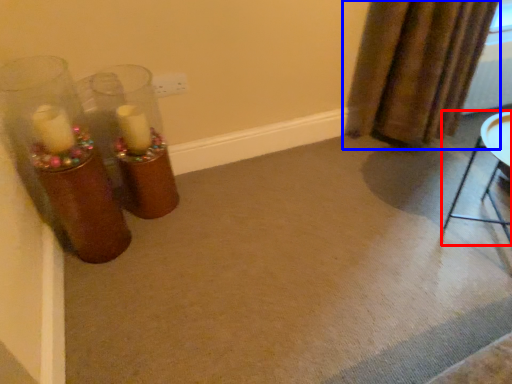
Question: Among these objects, which one is nearest to the camera, furniture (highlighted by a red box) or curtain (highlighted by a blue box)?

Choices:
 (A) furniture
 (B) curtain

Answer: (A)